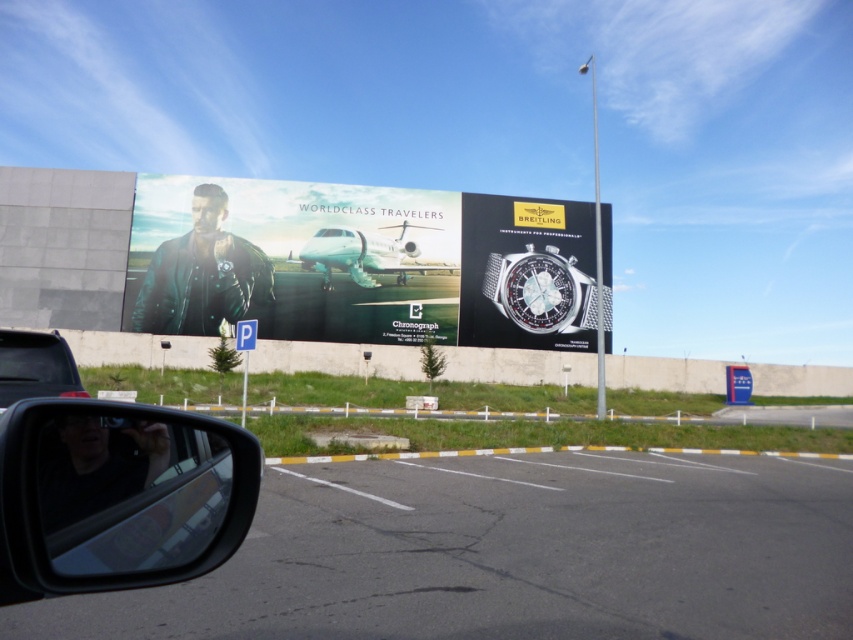
Can you confirm if matte black leather jacket at upper left is taller than black glossy side mirror at lower left?

Indeed, matte black leather jacket at upper left has a greater height compared to black glossy side mirror at lower left.

Is point (318, 282) farther from viewer compared to point (129, 545)?

That is True.

This screenshot has width=853, height=640. What are the coordinates of `matte black leather jacket at upper left` in the screenshot? It's located at (361, 262).

Does matte black leather jacket at upper left lie behind transparent glass at lower left?

Yes, it is.

Between point (206, 237) and point (9, 340), which one is positioned in front?

Point (9, 340)

Locate an element on the screen. This screenshot has width=853, height=640. matte black leather jacket at upper left is located at coordinates (361, 262).

You are a GUI agent. You are given a task and a screenshot of the screen. Output one action in this format:
    pyautogui.click(x=<x>, y=<y>)
    Task: Click on the matte black leather jacket at upper left
    
    Given the screenshot: What is the action you would take?
    point(361,262)

What do you see at coordinates (35, 365) in the screenshot? Image resolution: width=853 pixels, height=640 pixels. I see `black glossy car at lower left` at bounding box center [35, 365].

Is black glossy car at lower left further to the viewer compared to transparent glass at lower left?

No, black glossy car at lower left is in front of transparent glass at lower left.

Does point (3, 403) lie in front of point (42, 340)?

Yes, it is in front of point (42, 340).

At what (x,y) coordinates should I click in order to perform the action: click on black glossy car at lower left. Please return your answer as a coordinate pair (x, y). This screenshot has height=640, width=853. Looking at the image, I should click on (35, 365).